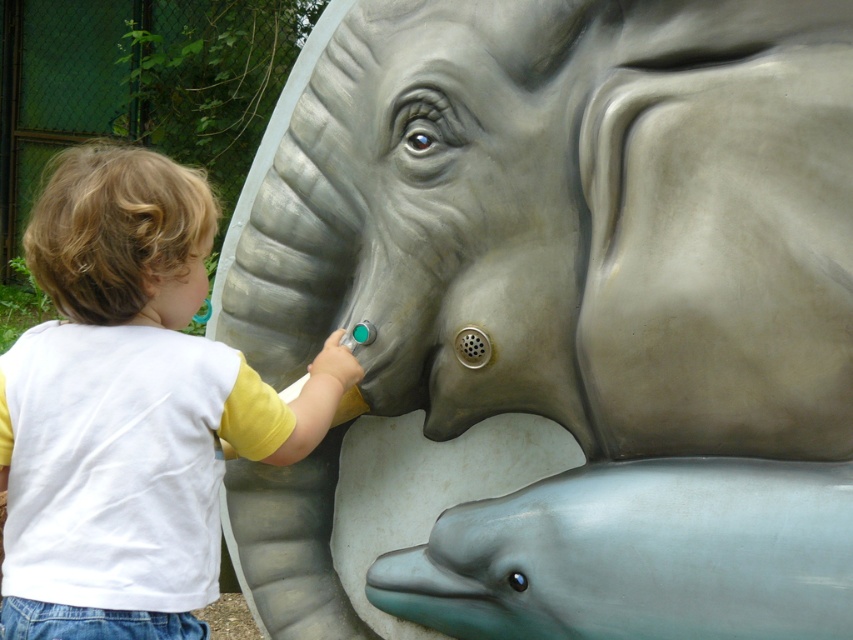
Does white/yellow t-shirt at left appear on the right side of smooth gray dolphin at lower center?

In fact, white/yellow t-shirt at left is to the left of smooth gray dolphin at lower center.

Describe the element at coordinates (136, 400) in the screenshot. I see `white/yellow t-shirt at left` at that location.

This screenshot has height=640, width=853. What do you see at coordinates (136, 400) in the screenshot?
I see `white/yellow t-shirt at left` at bounding box center [136, 400].

Locate an element on the screen. white/yellow t-shirt at left is located at coordinates (136, 400).